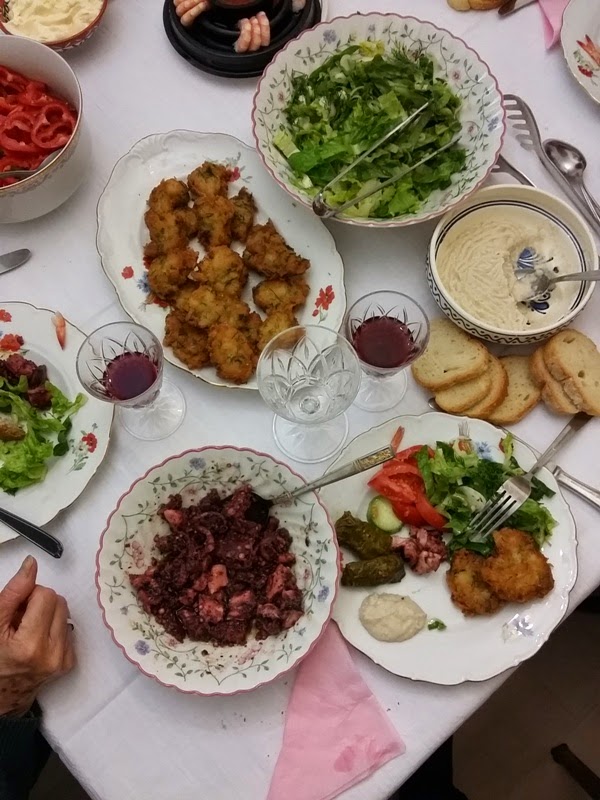
Image resolution: width=600 pixels, height=800 pixels. I want to click on plates, so click(61, 344), click(236, 472), click(369, 434), click(490, 149), click(182, 148), click(574, 46).